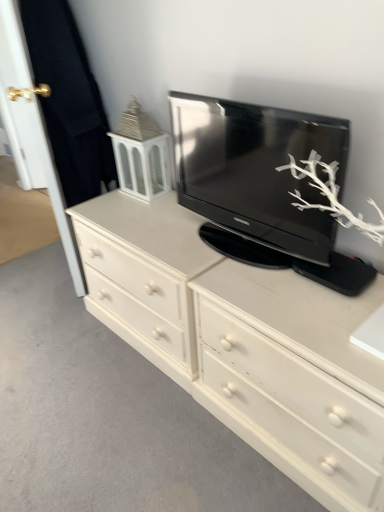
Where is `free space in front of white painted wood tv cabinet at upper left`? free space in front of white painted wood tv cabinet at upper left is located at coordinates click(x=145, y=212).